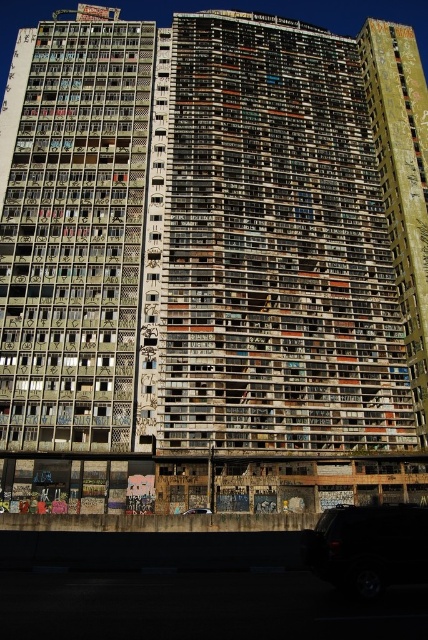
The image size is (428, 640). What do you see at coordinates (368, 547) in the screenshot? I see `shiny black suv at lower right` at bounding box center [368, 547].

Is shiny black suv at lower right closer to the viewer compared to black matte car at lower center?

Yes, shiny black suv at lower right is closer to the viewer.

Which is in front, point (410, 582) or point (186, 509)?

Point (410, 582) is more forward.

The height and width of the screenshot is (640, 428). Identify the location of shiny black suv at lower right. (368, 547).